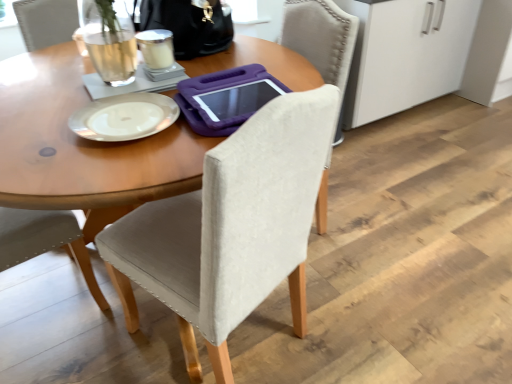
This screenshot has height=384, width=512. I want to click on free space in front of white frosted glass at upper center, so click(147, 87).